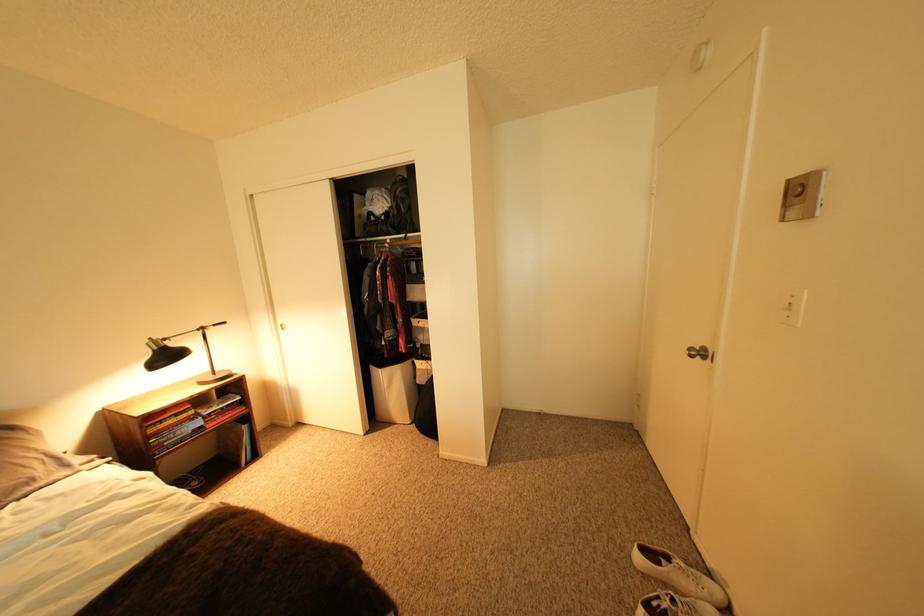
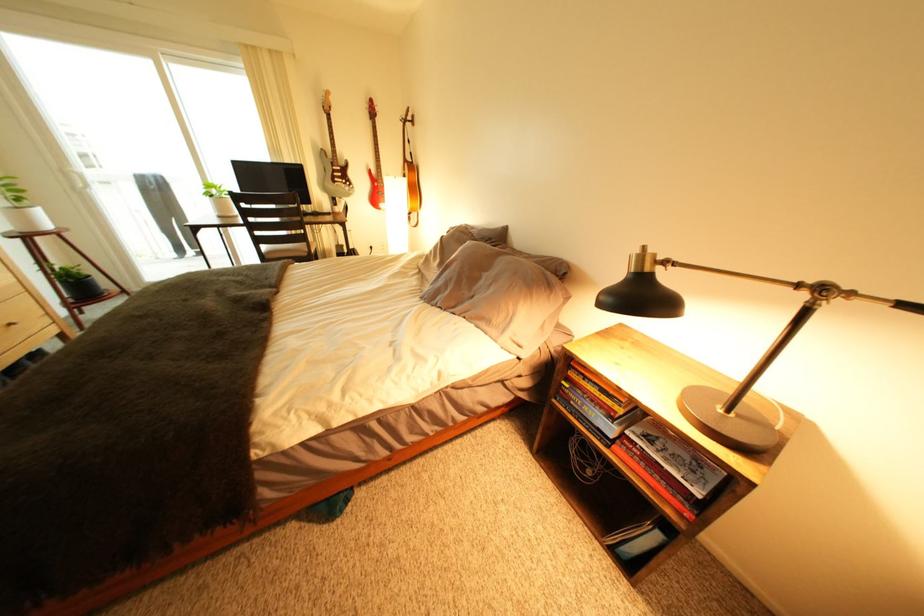
In the second image, find the point that corresponds to (252,400) in the first image.

(712, 496)